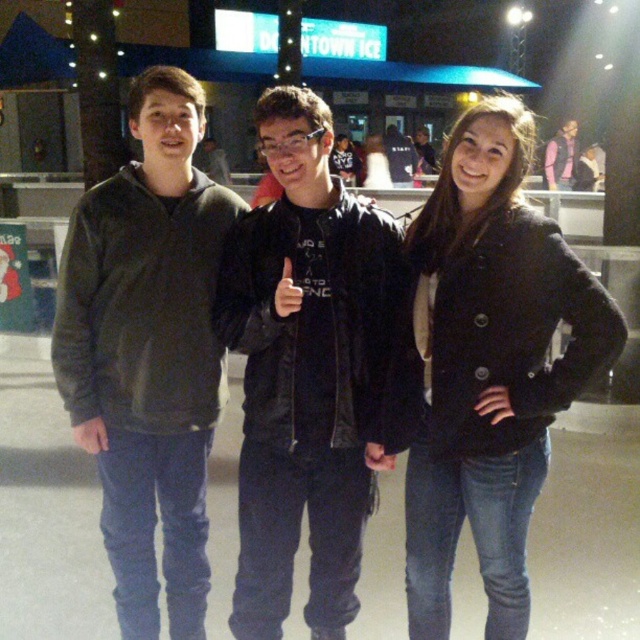
Question: Can you confirm if black leather jacket at center is thinner than pink fabric shirt at center?

Choices:
 (A) yes
 (B) no

Answer: (A)

Question: Does black fuzzy coat at center have a larger size compared to dark gray hoodie at left?

Choices:
 (A) yes
 (B) no

Answer: (B)

Question: Based on their relative distances, which object is farther from the black fuzzy coat at center?

Choices:
 (A) pink fabric shirt at center
 (B) dark gray hoodie at left

Answer: (A)

Question: Which of these objects is positioned farthest from the pink fabric shirt at center?

Choices:
 (A) dark gray hoodie at left
 (B) black fuzzy coat at center

Answer: (A)

Question: Which of these objects is positioned closest to the black fuzzy coat at center?

Choices:
 (A) dark gray hoodie at left
 (B) pink fabric shirt at center
 (C) black leather jacket at center

Answer: (C)

Question: Does black leather jacket at center appear on the right side of pink fabric shirt at center?

Choices:
 (A) yes
 (B) no

Answer: (B)